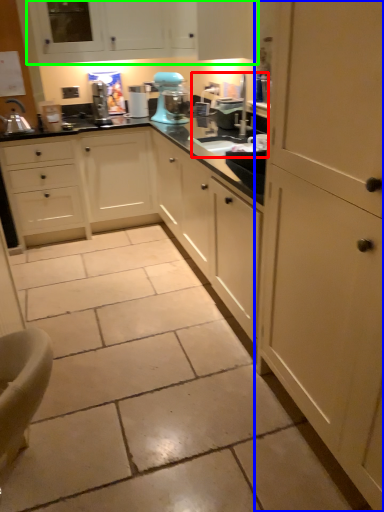
Question: Considering the real-world distances, which object is farthest from sink (highlighted by a red box)? cabinetry (highlighted by a blue box) or cabinetry (highlighted by a green box)?

Choices:
 (A) cabinetry
 (B) cabinetry

Answer: (A)